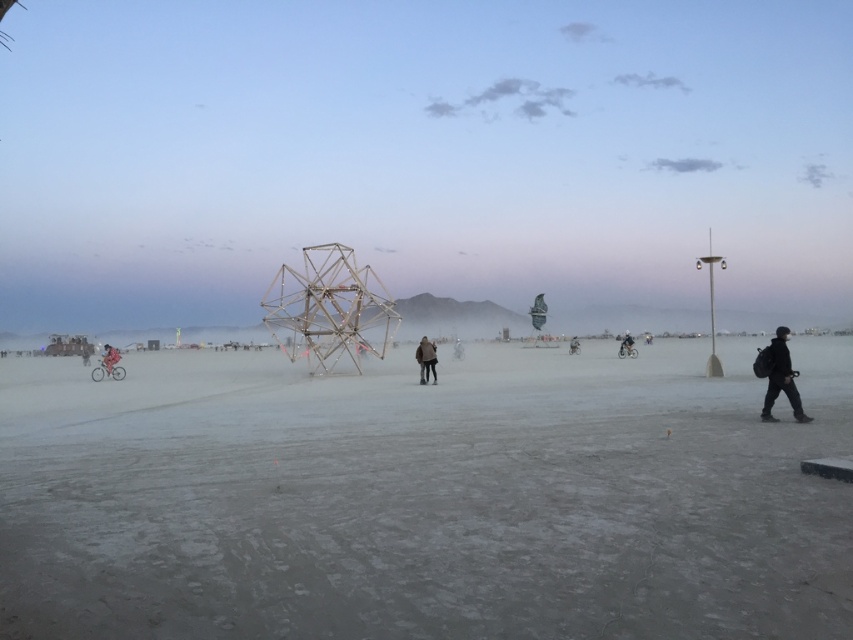
Question: Observing the image, what is the correct spatial positioning of black matte jacket at right in reference to dark gray jacket at center?

Choices:
 (A) right
 (B) left

Answer: (A)

Question: Is brown leather jacket at center positioned in front of brushed metal bicycle at left?

Choices:
 (A) no
 (B) yes

Answer: (B)

Question: Which point is closer to the camera?

Choices:
 (A) black matte jacket at right
 (B) black matte jacket at center

Answer: (A)

Question: Which object appears closest to the camera in this image?

Choices:
 (A) dark gray jacket at center
 (B) brushed metal bicycle at left
 (C) black matte jacket at center
 (D) black matte jacket at right

Answer: (D)

Question: Which is nearer to the gray sand at center?

Choices:
 (A) black matte jacket at right
 (B) brushed metal bicycle at left
 (C) dark gray jacket at center
 (D) black matte jacket at center

Answer: (A)

Question: Can you confirm if metallic structure at center is bigger than dark gray jacket at center?

Choices:
 (A) yes
 (B) no

Answer: (A)